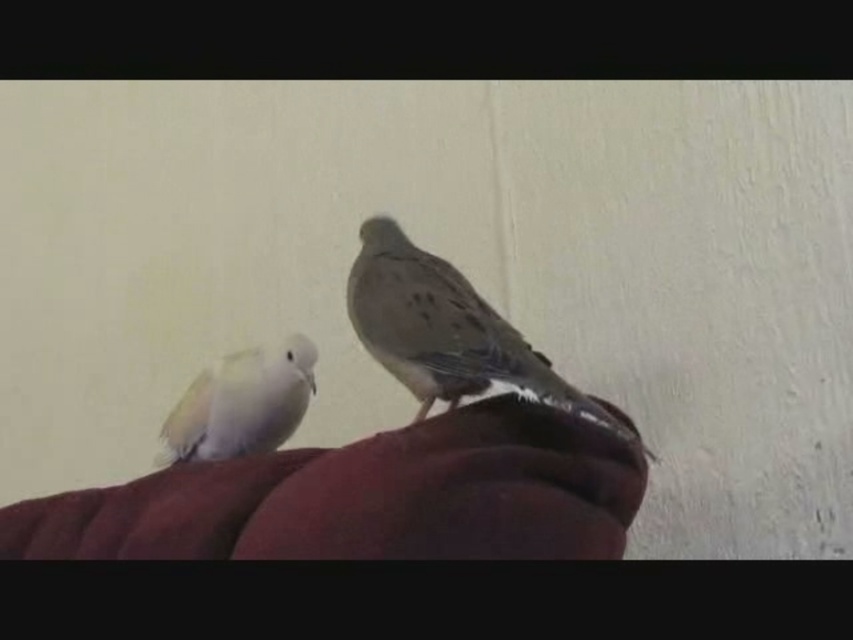
Which is above, brown speckled feather at center or white feathered bird at left?

Positioned higher is brown speckled feather at center.

Can you confirm if brown speckled feather at center is smaller than white feathered bird at left?

Actually, brown speckled feather at center might be larger than white feathered bird at left.

Between point (412, 348) and point (293, 401), which one is positioned behind?

Positioned behind is point (293, 401).

Image resolution: width=853 pixels, height=640 pixels. Identify the location of brown speckled feather at center. (445, 332).